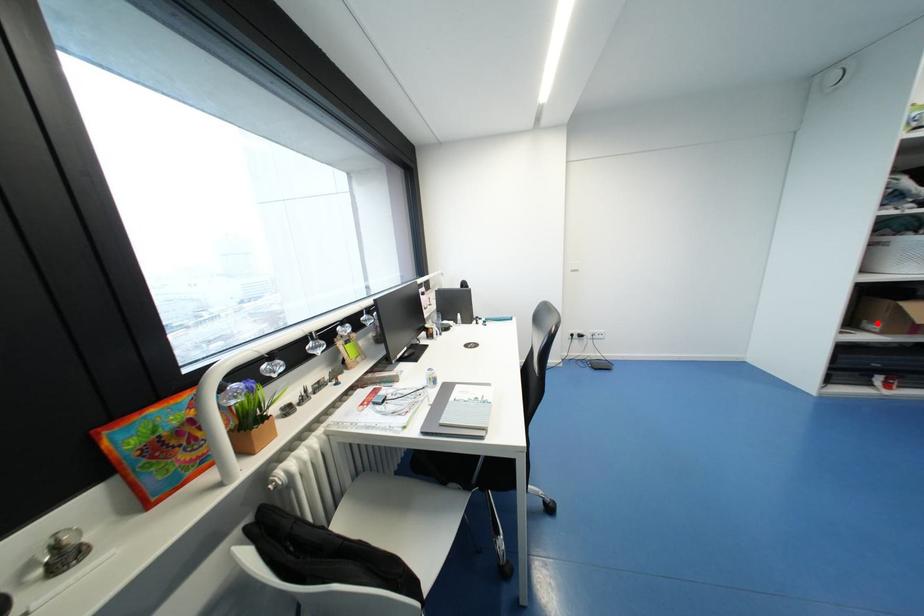
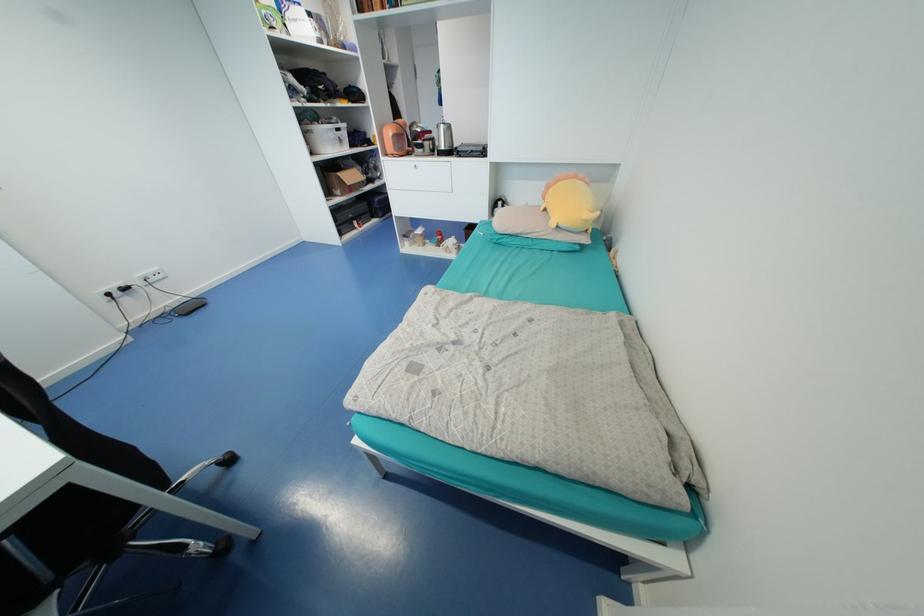
The point at the highlighted location is marked in the first image. Where is the corresponding point in the second image?

(341, 190)